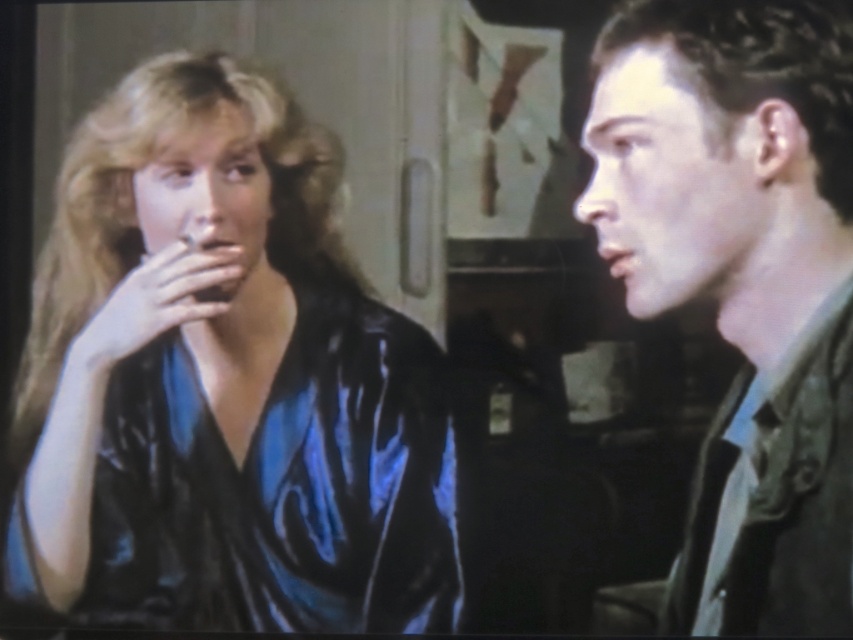
Question: Can you confirm if matte green jacket at right is bigger than silky blue robe at right?

Choices:
 (A) yes
 (B) no

Answer: (A)

Question: Is shiny blue silk blouse at left below matte green jacket at right?

Choices:
 (A) yes
 (B) no

Answer: (A)

Question: Among these objects, which one is farthest from the camera?

Choices:
 (A) shiny blue silk blouse at left
 (B) silky blue robe at right

Answer: (A)

Question: Is shiny blue silk blouse at left above matte green jacket at right?

Choices:
 (A) no
 (B) yes

Answer: (A)

Question: Which object is positioned closest to the shiny blue silk blouse at left?

Choices:
 (A) silky blue robe at right
 (B) matte green jacket at right

Answer: (B)

Question: Among these objects, which one is farthest from the camera?

Choices:
 (A) shiny blue silk blouse at left
 (B) matte green jacket at right

Answer: (A)